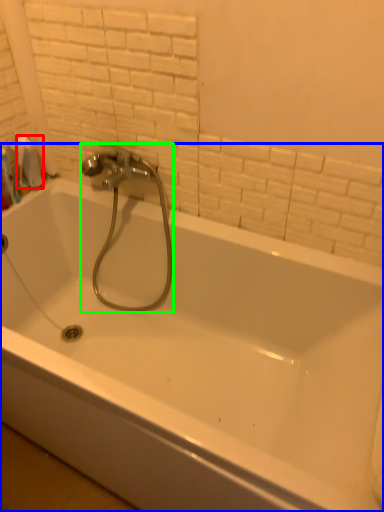
Question: Considering the real-world distances, which object is closest to toilet paper (highlighted by a red box)? bathtub (highlighted by a blue box) or plumbing fixture (highlighted by a green box).

Choices:
 (A) bathtub
 (B) plumbing fixture

Answer: (B)